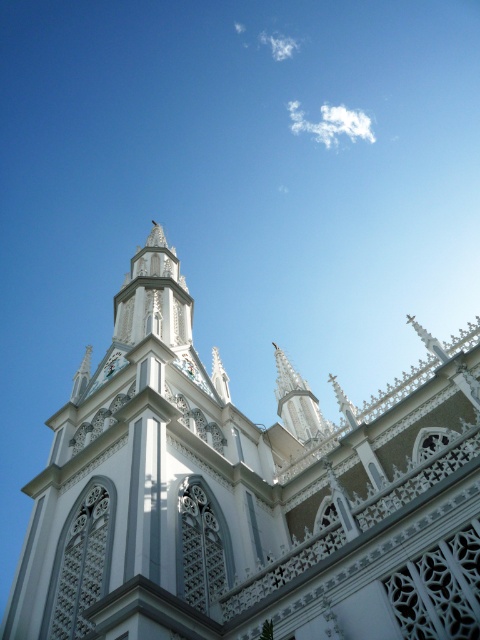
Is white lacework church at center closer to camera compared to white lace-like tower at center?

Yes, white lacework church at center is closer to the viewer.

Does white lacework church at center appear on the right side of white lace-like tower at center?

Incorrect, white lacework church at center is not on the right side of white lace-like tower at center.

I want to click on white lacework church at center, so click(x=248, y=497).